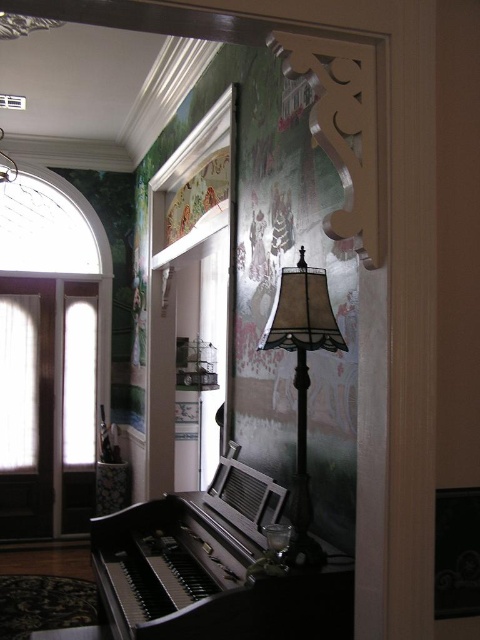
This screenshot has height=640, width=480. What do you see at coordinates (213, 568) in the screenshot? I see `black polished piano at lower left` at bounding box center [213, 568].

Is black polished piano at lower left above matte beige lampshade at center?

No, black polished piano at lower left is not above matte beige lampshade at center.

Is point (153, 545) closer to camera compared to point (297, 300)?

No, (153, 545) is further to viewer.

The image size is (480, 640). In order to click on black polished piano at lower left in this screenshot , I will do `click(213, 568)`.